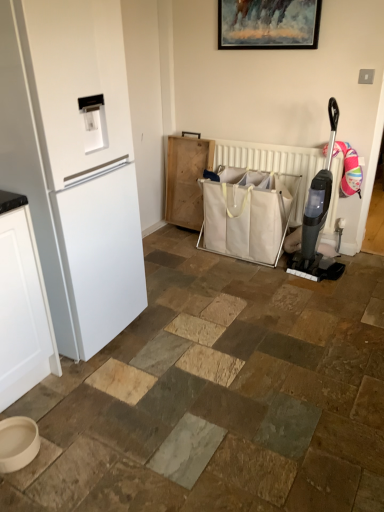
Question: Is black plastic vacuum cleaner at right at the right side of white matte refrigerator at left?

Choices:
 (A) yes
 (B) no

Answer: (A)

Question: Does black plastic vacuum cleaner at right have a greater width compared to white matte refrigerator at left?

Choices:
 (A) no
 (B) yes

Answer: (A)

Question: Could you tell me if black plastic vacuum cleaner at right is facing white matte refrigerator at left?

Choices:
 (A) no
 (B) yes

Answer: (A)

Question: Considering the relative sizes of black plastic vacuum cleaner at right and white matte refrigerator at left in the image provided, is black plastic vacuum cleaner at right smaller than white matte refrigerator at left?

Choices:
 (A) no
 (B) yes

Answer: (B)

Question: Does black plastic vacuum cleaner at right touch white matte refrigerator at left?

Choices:
 (A) no
 (B) yes

Answer: (A)

Question: Looking at their shapes, would you say wooden picture frame at upper center is wider or thinner than white matte refrigerator at left?

Choices:
 (A) thin
 (B) wide

Answer: (A)

Question: From a real-world perspective, is wooden picture frame at upper center above or below white matte refrigerator at left?

Choices:
 (A) above
 (B) below

Answer: (A)

Question: Is point (238, 9) closer or farther from the camera than point (107, 221)?

Choices:
 (A) closer
 (B) farther

Answer: (B)

Question: Is wooden picture frame at upper center bigger or smaller than white matte refrigerator at left?

Choices:
 (A) big
 (B) small

Answer: (B)

Question: Choose the correct answer: Is white matte refrigerator at left inside white canvas shopping bag at center or outside it?

Choices:
 (A) inside
 (B) outside

Answer: (B)

Question: In terms of height, does white matte refrigerator at left look taller or shorter compared to white canvas shopping bag at center?

Choices:
 (A) short
 (B) tall

Answer: (B)

Question: From a real-world perspective, is white matte refrigerator at left above or below white canvas shopping bag at center?

Choices:
 (A) above
 (B) below

Answer: (A)

Question: Is point (18, 155) closer or farther from the camera than point (236, 243)?

Choices:
 (A) closer
 (B) farther

Answer: (A)

Question: From the image's perspective, is black plastic vacuum cleaner at right positioned above or below wooden picture frame at upper center?

Choices:
 (A) below
 (B) above

Answer: (A)

Question: Considering the positions of black plastic vacuum cleaner at right and wooden picture frame at upper center in the image, is black plastic vacuum cleaner at right bigger or smaller than wooden picture frame at upper center?

Choices:
 (A) small
 (B) big

Answer: (B)